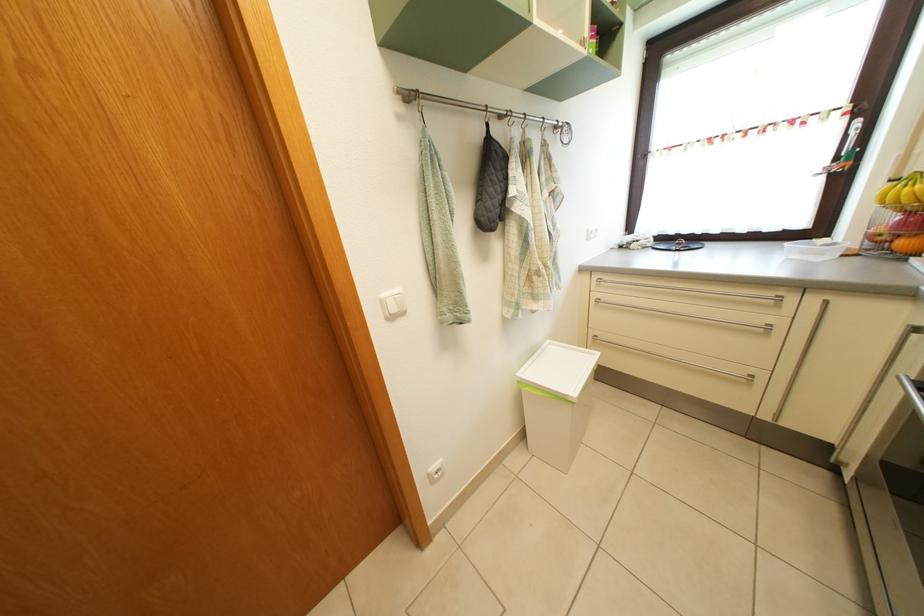
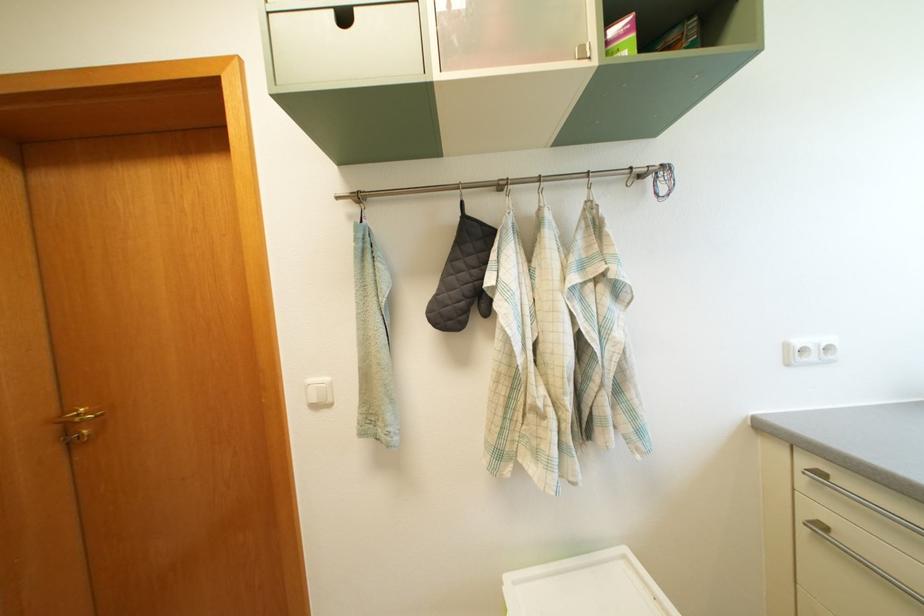
Locate, in the second image, the point that corresponds to pixel 596 238 in the first image.

(795, 353)